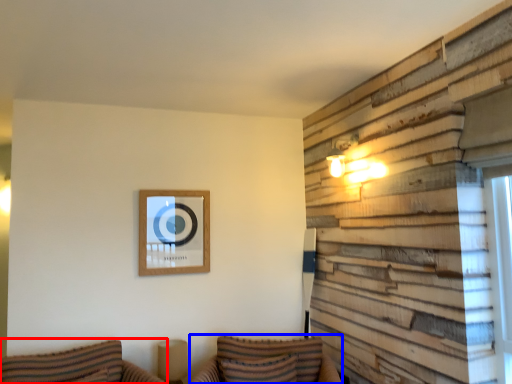
Question: Which object is further to the camera taking this photo, couch (highlighted by a red box) or couch (highlighted by a blue box)?

Choices:
 (A) couch
 (B) couch

Answer: (B)